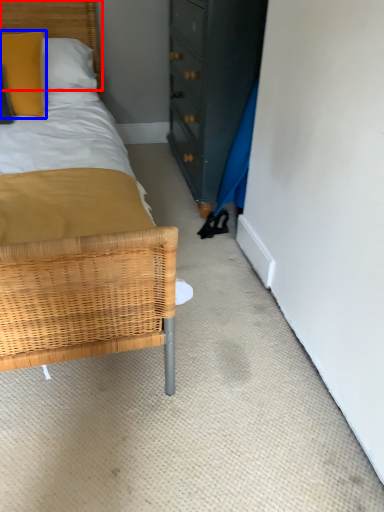
Question: Which object is further to the camera taking this photo, headboard (highlighted by a red box) or pillow (highlighted by a blue box)?

Choices:
 (A) headboard
 (B) pillow

Answer: (A)